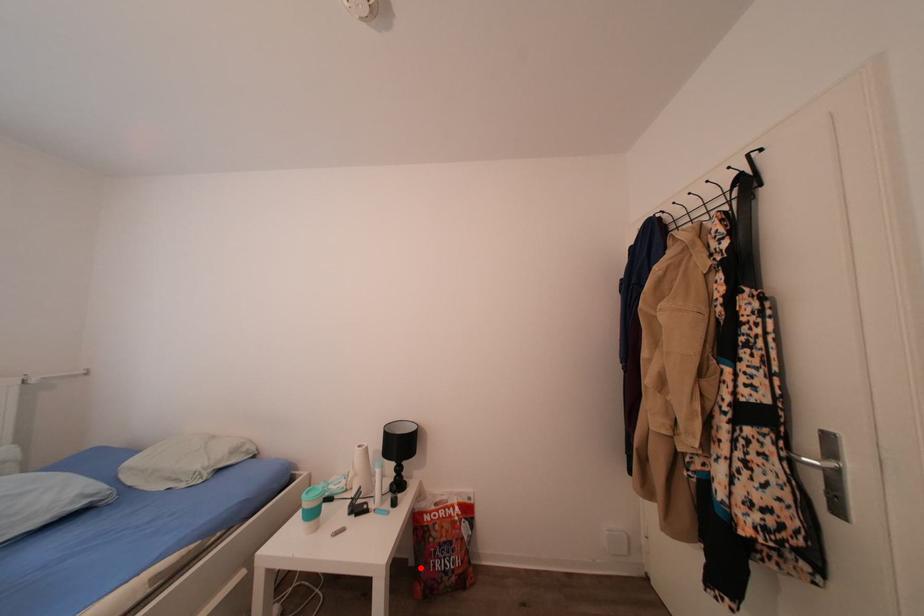
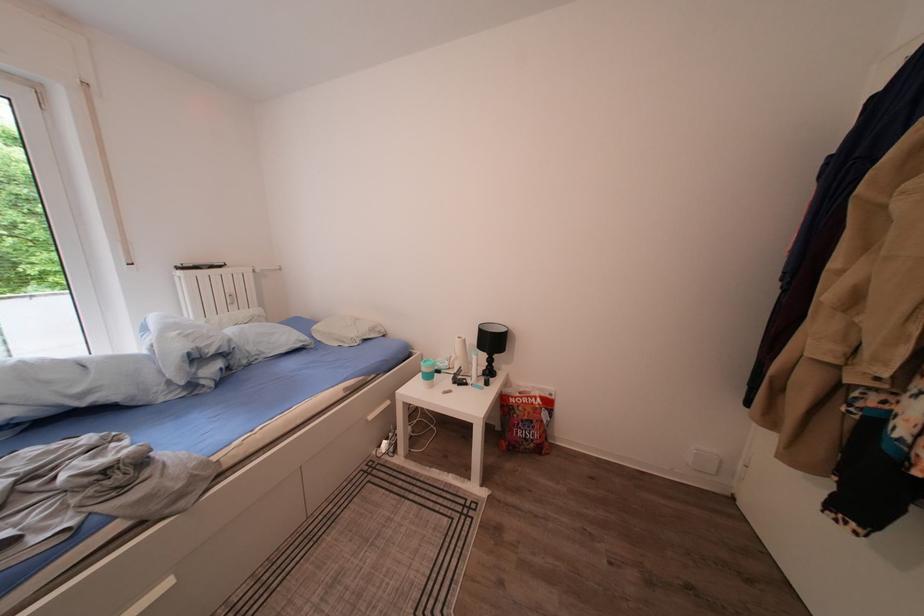
The point at the highlighted location is marked in the first image. Where is the corresponding point in the second image?

(506, 432)